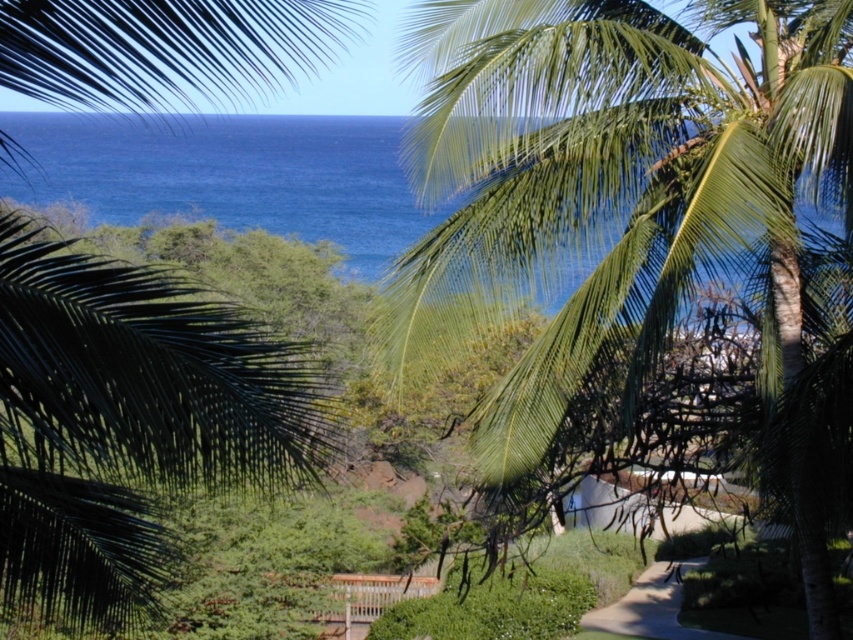
Question: Is green leafy palm tree at upper right above green leafy palm tree at upper left?

Choices:
 (A) yes
 (B) no

Answer: (B)

Question: Which point appears closest to the camera in this image?

Choices:
 (A) (235, 307)
 (B) (759, 296)

Answer: (A)

Question: Can you confirm if green leafy palm tree at upper right is positioned below green leafy palm tree at upper left?

Choices:
 (A) yes
 (B) no

Answer: (A)

Question: Which point is farther from the camera taking this photo?

Choices:
 (A) (517, 481)
 (B) (102, 72)

Answer: (A)

Question: Among these objects, which one is farthest from the camera?

Choices:
 (A) green leafy palm tree at upper left
 (B) green leafy palm tree at upper right

Answer: (B)

Question: Is green leafy palm tree at upper right to the left of green leafy palm tree at upper left from the viewer's perspective?

Choices:
 (A) yes
 (B) no

Answer: (B)